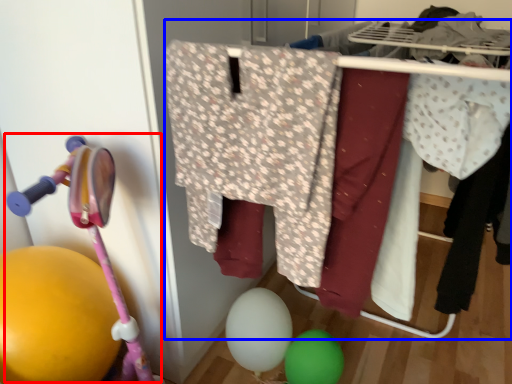
Question: Which object is further to the camera taking this photo, baby carriage (highlighted by a red box) or closet (highlighted by a blue box)?

Choices:
 (A) baby carriage
 (B) closet

Answer: (A)